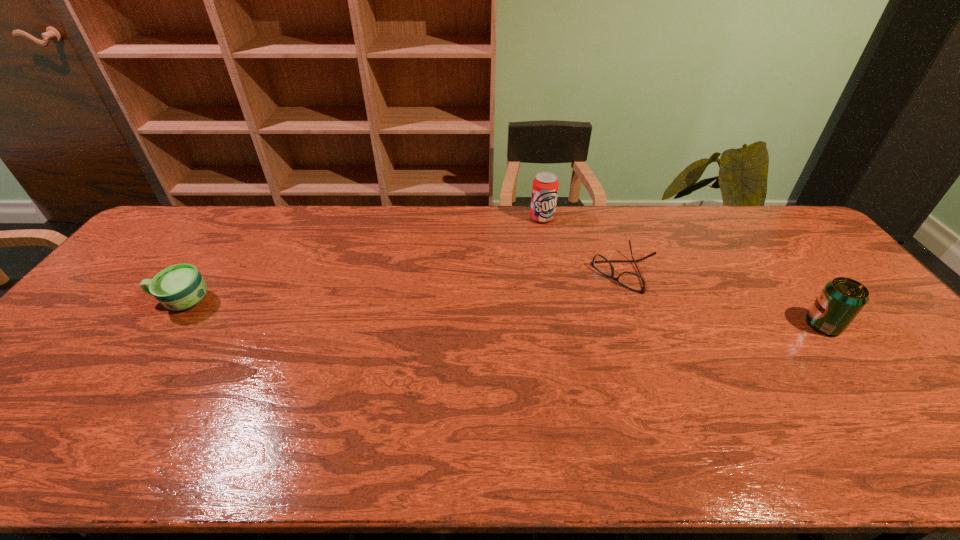
Find the location of a particular element. free point between the shortest object and the beer can is located at coordinates (724, 299).

The height and width of the screenshot is (540, 960). In order to click on free spot between the shortest object and the third shortest object in this screenshot , I will do `click(724, 299)`.

The height and width of the screenshot is (540, 960). I want to click on object that is the second closest one to the shortest object, so click(841, 300).

Choose which object is the third nearest neighbor to the tallest object. Please provide its 2D coordinates. Your answer should be formatted as a tuple, i.e. [(x, y)], where the tuple contains the x and y coordinates of a point satisfying the conditions above.

[(179, 287)]

Find the location of a particular element. Image resolution: width=960 pixels, height=540 pixels. vacant space that satisfies the following two spatial constraints: 1. on the front side of the tallest object; 2. on the left side of the spectacles is located at coordinates (552, 273).

Locate an element on the screen. vacant area in the image that satisfies the following two spatial constraints: 1. on the front side of the second tallest object; 2. on the left side of the leftmost object is located at coordinates (165, 325).

Where is `free spot that satisfies the following two spatial constraints: 1. on the front side of the spectacles; 2. on the right side of the third object from right to left`? This screenshot has height=540, width=960. free spot that satisfies the following two spatial constraints: 1. on the front side of the spectacles; 2. on the right side of the third object from right to left is located at coordinates (552, 273).

At what (x,y) coordinates should I click in order to perform the action: click on blank area in the image that satisfies the following two spatial constraints: 1. on the front side of the third object from left to right; 2. on the right side of the tallest object. Please return your answer as a coordinate pair (x, y). Looking at the image, I should click on (552, 273).

Where is `vacant position in the image that satisfies the following two spatial constraints: 1. on the front side of the beer can; 2. on the right side of the spectacles`? This screenshot has height=540, width=960. vacant position in the image that satisfies the following two spatial constraints: 1. on the front side of the beer can; 2. on the right side of the spectacles is located at coordinates (643, 325).